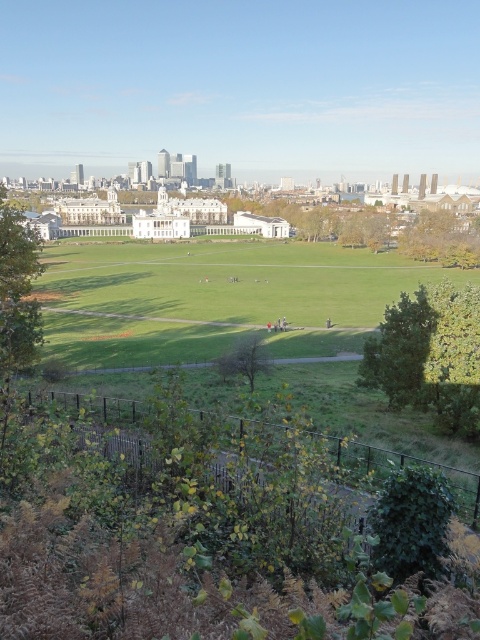
You are standing in the park and want to walk from the green grassy field at center to the green leafy tree at center. Which direction should you move to get closer to the tree?

You should move forward towards the green leafy tree at center because it is closer to you than the green grassy field at center.

You are planning to set up a picnic blanket in the park. The green leafy tree at lower left provides shade, but you want to ensure there is enough space between the tree and the green grassy field at center for your picnic setup. Based on the scene, can you determine if the grassy field is wider than the tree?

The green grassy field at center is wider than the green leafy tree at lower left, so there is sufficient space between them for your picnic setup.